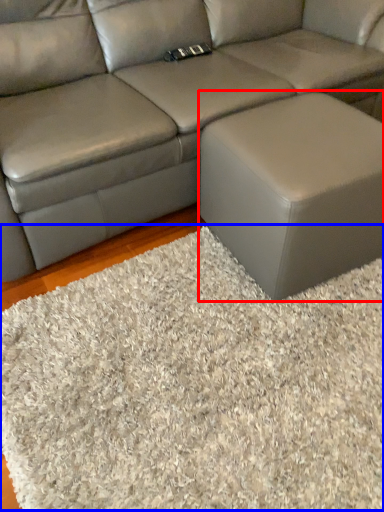
Question: Which object is closer to the camera taking this photo, stool (highlighted by a red box) or mat (highlighted by a blue box)?

Choices:
 (A) stool
 (B) mat

Answer: (B)